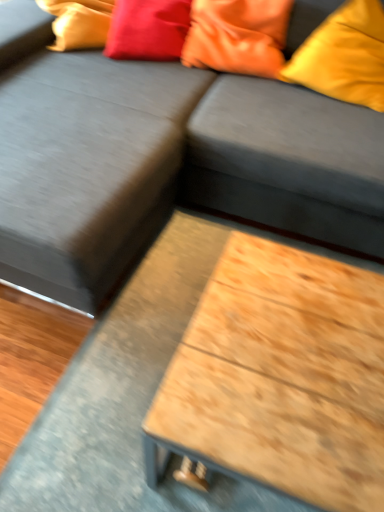
Question: From a real-world perspective, is satin red pillow at upper center, arranged as the 1th pillow when viewed from the left, above or below dark gray fabric couch at center?

Choices:
 (A) below
 (B) above

Answer: (B)

Question: Is satin red pillow at upper center, arranged as the 1th pillow when viewed from the left, to the left or to the right of dark gray fabric couch at center in the image?

Choices:
 (A) right
 (B) left

Answer: (B)

Question: Estimate the real-world distances between objects in this image. Which object is closer to the wooden table at center?

Choices:
 (A) matte orange pillow at upper right, the first pillow positioned from the right
 (B) satin red pillow at upper center, the 3th pillow when ordered from right to left
 (C) orange satin pillow at upper right, which is counted as the second pillow, starting from the right
 (D) dark gray fabric couch at center
 (E) wooden at lower right

Answer: (D)

Question: Estimate the real-world distances between objects in this image. Which object is closer to the orange satin pillow at upper right, marked as the 2th pillow in a left-to-right arrangement?

Choices:
 (A) satin red pillow at upper center, arranged as the 1th pillow when viewed from the left
 (B) wooden table at center
 (C) wooden at lower right
 (D) matte orange pillow at upper right, placed as the third pillow when sorted from left to right
 (E) dark gray fabric couch at center

Answer: (A)